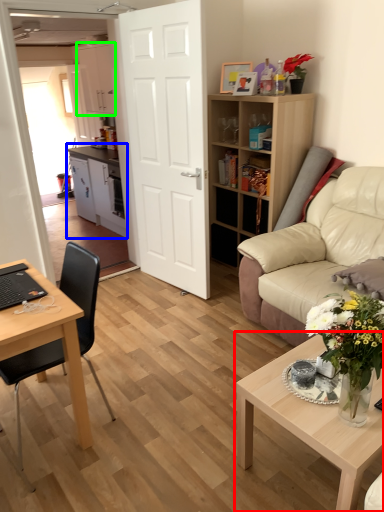
Question: Considering the real-world distances, which object is closest to coffee table (highlighted by a red box)? cabinetry (highlighted by a blue box) or cabinetry (highlighted by a green box).

Choices:
 (A) cabinetry
 (B) cabinetry

Answer: (A)